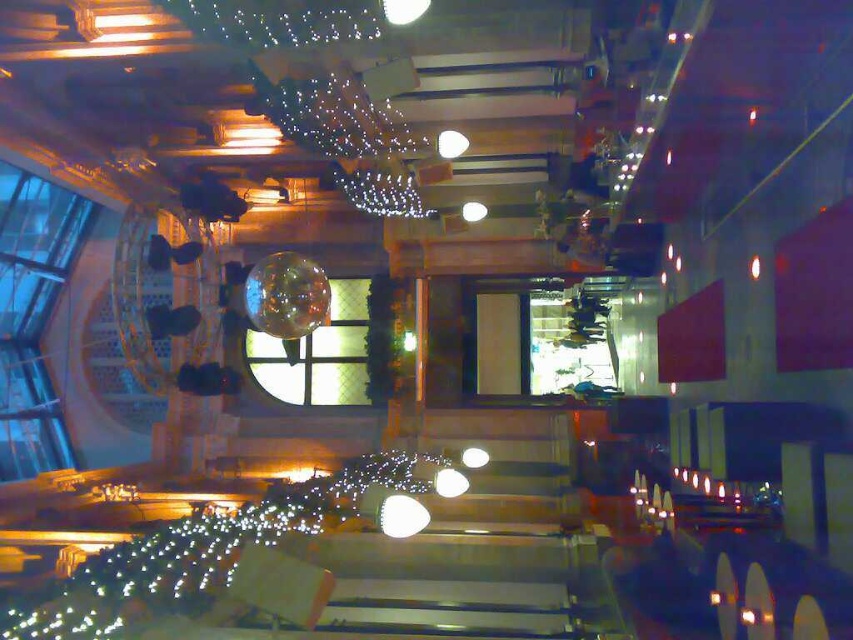
Between point (144, 609) and point (358, 310), which one is positioned behind?

Point (358, 310)

Can you confirm if illuminated string lights at center is positioned to the right of clear glass window at center?

Yes, illuminated string lights at center is to the right of clear glass window at center.

This screenshot has height=640, width=853. Identify the location of illuminated string lights at center. [x=206, y=550].